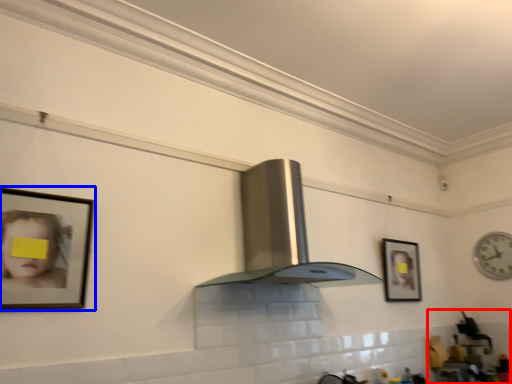
Question: Which object appears farthest to the camera in this image, sink (highlighted by a red box) or picture frame (highlighted by a blue box)?

Choices:
 (A) sink
 (B) picture frame

Answer: (A)